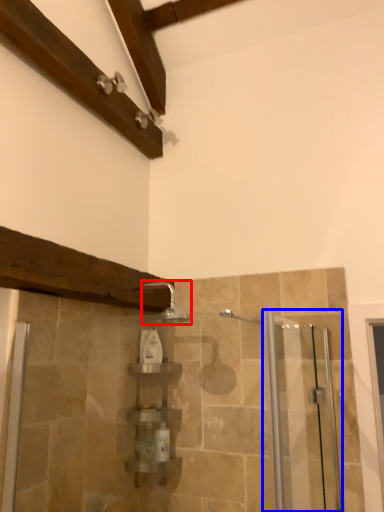
Question: Which object appears farthest to the camera in this image, shower (highlighted by a red box) or screen door (highlighted by a blue box)?

Choices:
 (A) shower
 (B) screen door

Answer: (A)